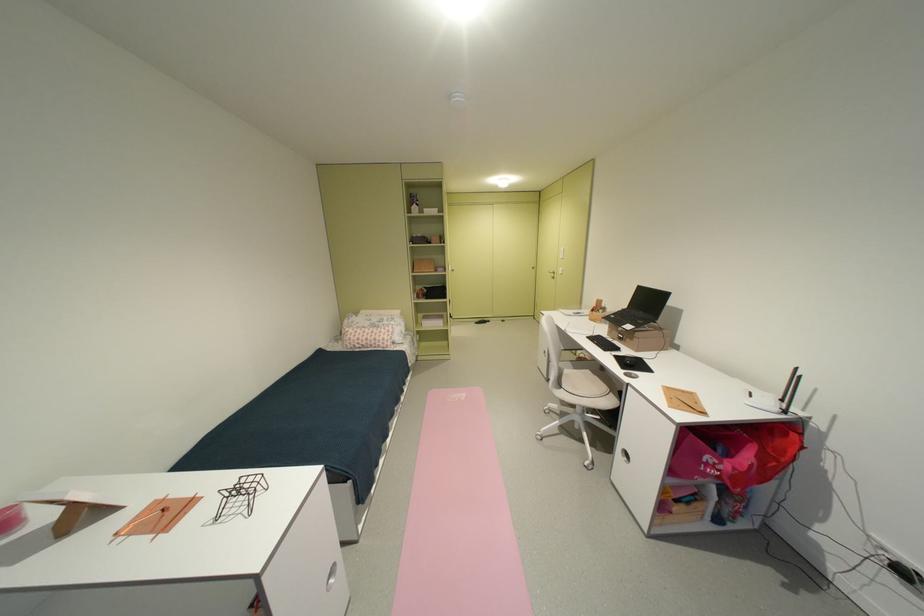
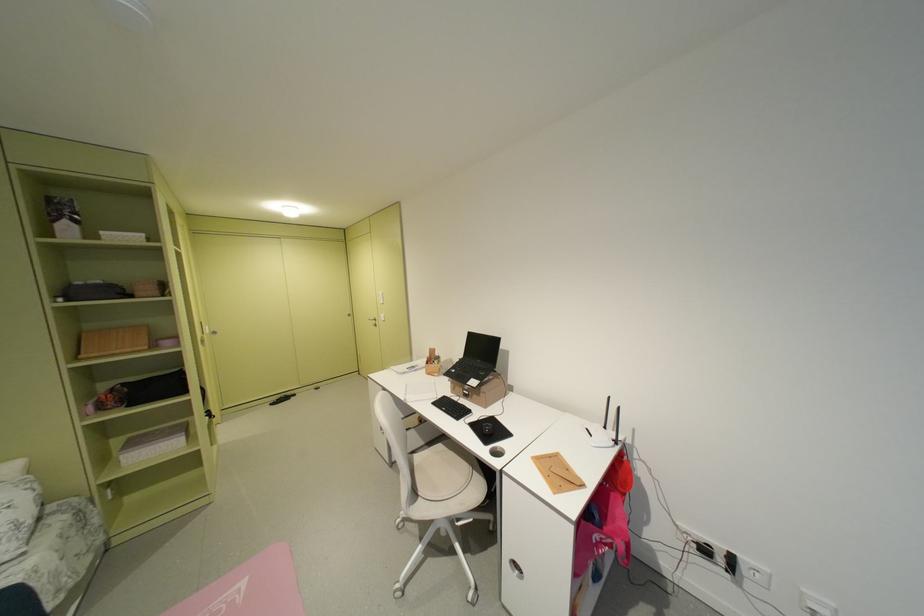
Question: The images are taken continuously from a first-person perspective. In which direction is your viewpoint rotating?

Choices:
 (A) Left
 (B) Right
 (C) Up
 (D) Down

Answer: (B)